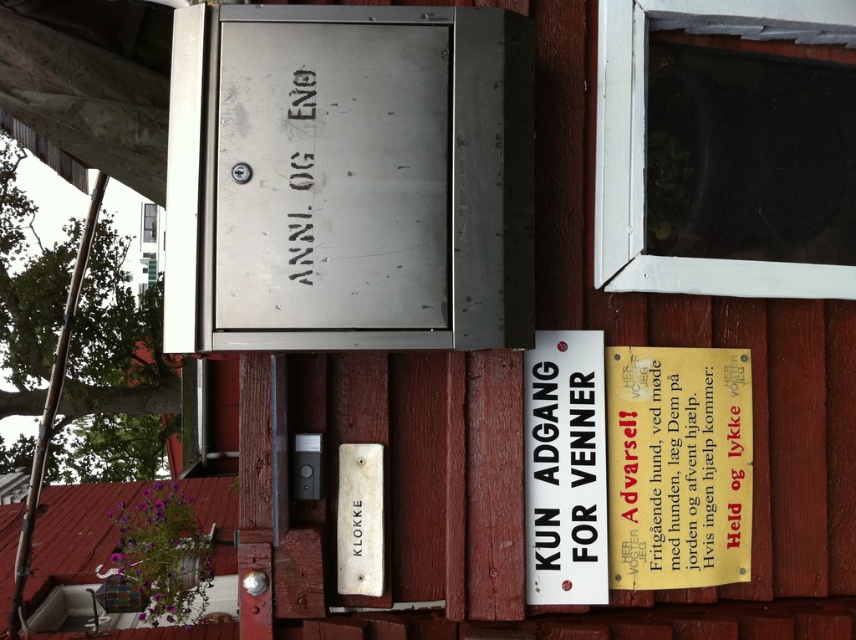
Looking at this image, you are standing in front of a wooden wall with several items mounted on it. You notice two points marked on the wall at coordinates point 1 at [611,406] and point 2 at [531,561]. If you want to touch both points starting from your current position, which point should you reach first?

You should reach point 1 at [611,406] first because it is closer to you than point 2 at [531,561] since it is further to the camera.

You are a visitor approaching the wooden wall with the mailbox and plaques. You see the metallic warning sign at right and the black metallic text at upper center. Which object is located to the right of the other?

The metallic warning sign at right is positioned on the right side of the black metallic text at upper center.